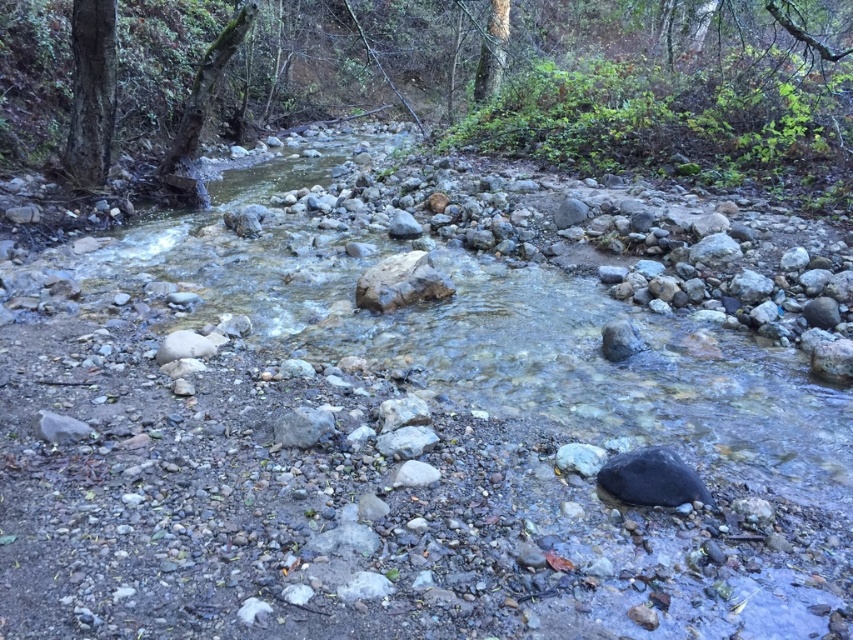
Question: Which of these objects is positioned farthest from the smooth bark tree at upper left?

Choices:
 (A) green mossy tree trunk at upper left
 (B) smooth gray rock at center

Answer: (B)

Question: Can you confirm if smooth bark tree at upper left is smaller than smooth gray rock at center?

Choices:
 (A) no
 (B) yes

Answer: (A)

Question: Among these points, which one is nearest to the camera?

Choices:
 (A) (502, 49)
 (B) (198, 72)
 (C) (367, 301)

Answer: (C)

Question: In this image, where is smooth bark tree at upper left located relative to green mossy tree trunk at upper left?

Choices:
 (A) below
 (B) above

Answer: (A)

Question: Among these points, which one is nearest to the camera?

Choices:
 (A) (486, 76)
 (B) (207, 92)

Answer: (B)

Question: Does smooth bark tree at upper left appear on the right side of green mossy tree trunk at upper left?

Choices:
 (A) no
 (B) yes

Answer: (A)